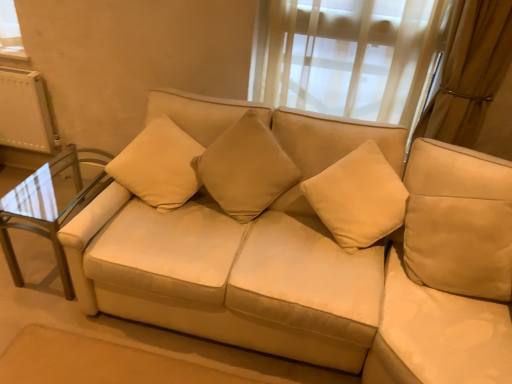
Question: Is clear glass table at left inside beige fabric pillow at upper left, arranged as the first pillow when viewed from the left?

Choices:
 (A) no
 (B) yes

Answer: (A)

Question: From a real-world perspective, is beige fabric pillow at upper left, arranged as the first pillow when viewed from the left, physically above clear glass table at left?

Choices:
 (A) yes
 (B) no

Answer: (A)

Question: Is beige fabric pillow at upper left, arranged as the first pillow when viewed from the left, to the right of clear glass table at left from the viewer's perspective?

Choices:
 (A) yes
 (B) no

Answer: (A)

Question: Can you see beige fabric pillow at upper left, arranged as the first pillow when viewed from the left, touching clear glass table at left?

Choices:
 (A) no
 (B) yes

Answer: (A)

Question: From the image's perspective, is beige fabric pillow at upper left, which is counted as the 2th pillow, starting from the right, located beneath clear glass table at left?

Choices:
 (A) yes
 (B) no

Answer: (B)

Question: In the image, is beige fabric pillow at upper left, which is counted as the 2th pillow, starting from the right, on the left side or the right side of suede-like beige pillow at center, which is the 2th pillow from left to right?

Choices:
 (A) right
 (B) left

Answer: (B)

Question: From the image's perspective, relative to suede-like beige pillow at center, which is the first pillow in right-to-left order, is beige fabric pillow at upper left, which is counted as the 2th pillow, starting from the right, above or below?

Choices:
 (A) below
 (B) above

Answer: (B)

Question: Is point (153, 139) positioned closer to the camera than point (254, 210)?

Choices:
 (A) closer
 (B) farther

Answer: (A)

Question: Considering the positions of beige fabric pillow at upper left, arranged as the first pillow when viewed from the left, and suede-like beige pillow at center, which is the first pillow in right-to-left order, in the image, is beige fabric pillow at upper left, arranged as the first pillow when viewed from the left, wider or thinner than suede-like beige pillow at center, which is the first pillow in right-to-left order,?

Choices:
 (A) thin
 (B) wide

Answer: (B)

Question: Is clear glass table at left inside or outside of beige fabric pillow at upper left, arranged as the first pillow when viewed from the left?

Choices:
 (A) outside
 (B) inside

Answer: (A)

Question: In the image, is clear glass table at left positioned in front of or behind beige fabric pillow at upper left, arranged as the first pillow when viewed from the left?

Choices:
 (A) front
 (B) behind

Answer: (B)

Question: Is point (25, 215) positioned closer to the camera than point (144, 137)?

Choices:
 (A) closer
 (B) farther

Answer: (A)

Question: In terms of height, does clear glass table at left look taller or shorter compared to beige fabric pillow at upper left, which is counted as the 2th pillow, starting from the right?

Choices:
 (A) short
 (B) tall

Answer: (A)

Question: Does point (5, 233) appear closer or farther from the camera than point (257, 173)?

Choices:
 (A) farther
 (B) closer

Answer: (A)

Question: From a real-world perspective, is clear glass table at left physically located above or below suede-like beige pillow at center, which is the 2th pillow from left to right?

Choices:
 (A) above
 (B) below

Answer: (B)